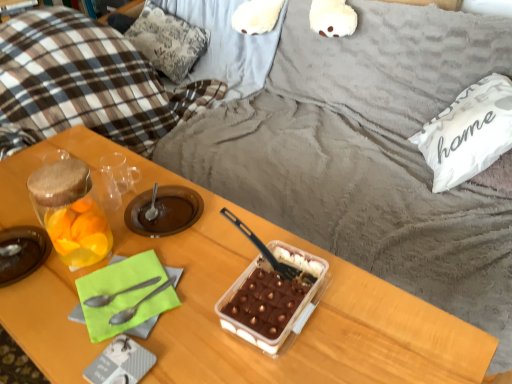
Locate an element on the screen. This screenshot has width=512, height=384. vacant space in front of translucent plastic tray at center, the 2th snack positioned from the left is located at coordinates 292,359.